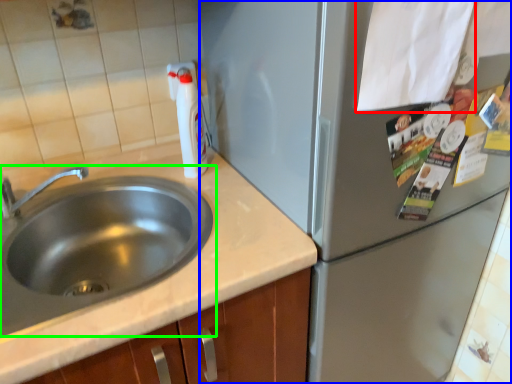
Question: Which object is positioned farthest from paper (highlighted by a red box)? Select from appliance (highlighted by a blue box) and sink (highlighted by a green box).

Choices:
 (A) appliance
 (B) sink

Answer: (B)